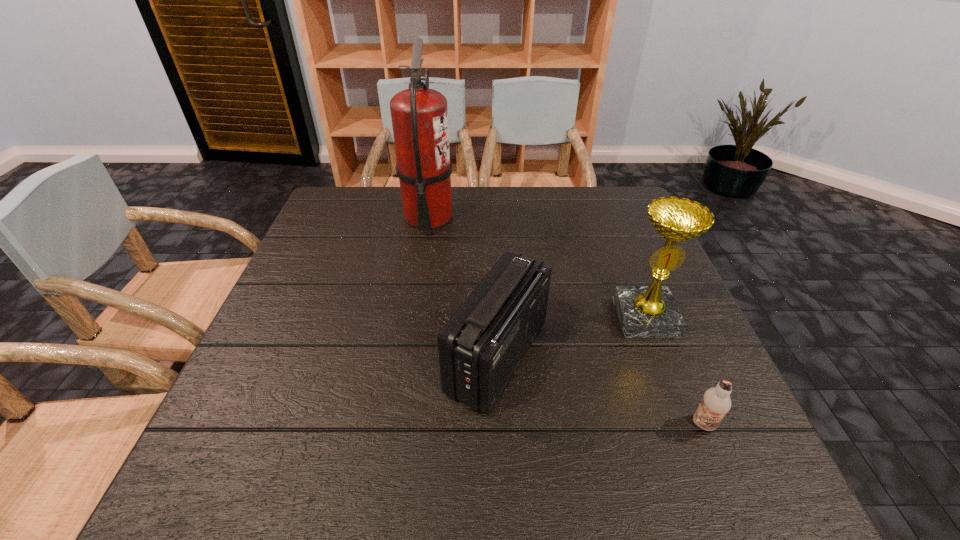
Where is `blank space at the far right corner`? blank space at the far right corner is located at coordinates (588, 193).

The height and width of the screenshot is (540, 960). Identify the location of free area in between the farthest object and the chocolate milk. (566, 321).

Identify the location of vacant area that lies between the award and the shortest object. The image size is (960, 540). (675, 371).

You are a GUI agent. You are given a task and a screenshot of the screen. Output one action in this format:
    pyautogui.click(x=<x>, y=<y>)
    Task: Click on the vacant region between the fire extinguisher and the chocolate milk
    The height and width of the screenshot is (540, 960).
    Given the screenshot: What is the action you would take?
    pyautogui.click(x=566, y=321)

I want to click on blank region between the chocolate milk and the fire extinguisher, so click(x=566, y=321).

Where is `free space between the radio receiver and the fire extinguisher`? This screenshot has height=540, width=960. free space between the radio receiver and the fire extinguisher is located at coordinates (463, 287).

Where is `blank region between the tallest object and the chocolate milk`? The height and width of the screenshot is (540, 960). blank region between the tallest object and the chocolate milk is located at coordinates (566, 321).

Find the location of a particular element. Image resolution: width=960 pixels, height=540 pixels. free space between the third tallest object and the tallest object is located at coordinates (463, 287).

The image size is (960, 540). Find the location of `vacant point located between the shortest object and the award`. vacant point located between the shortest object and the award is located at coordinates (675, 371).

The image size is (960, 540). I want to click on free space between the shortest object and the farthest object, so click(x=566, y=321).